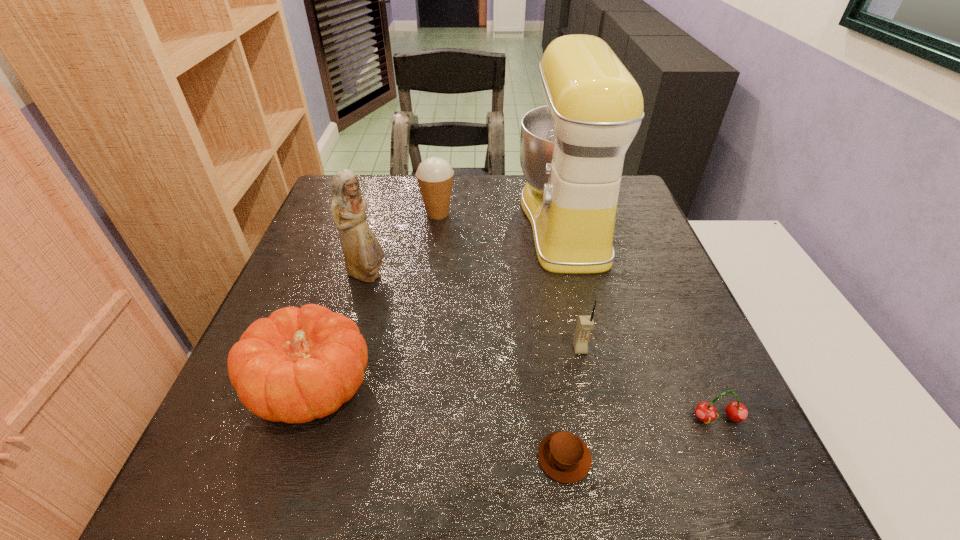
Identify the location of free space that is in between the tallest object and the muffin. (564, 340).

You are a GUI agent. You are given a task and a screenshot of the screen. Output one action in this format:
    pyautogui.click(x=<x>, y=<y>)
    Task: Click on the vacant space that is in between the pumpkin and the cellular telephone
    The width and height of the screenshot is (960, 540).
    Given the screenshot: What is the action you would take?
    pyautogui.click(x=446, y=368)

Locate an element on the screen. This screenshot has height=540, width=960. free space between the tallest object and the shortest object is located at coordinates (564, 340).

Image resolution: width=960 pixels, height=540 pixels. Find the location of `vacant point located between the mixer and the third object from left to right`. vacant point located between the mixer and the third object from left to right is located at coordinates (502, 218).

I want to click on vacant space that is in between the icecream and the figurine, so click(402, 245).

Locate an element on the screen. The image size is (960, 540). vacant area that lies between the fifth object from right to left and the cellular telephone is located at coordinates (509, 281).

I want to click on blank region between the muffin and the pumpkin, so click(439, 422).

I want to click on free spot between the fifth object from right to left and the pumpkin, so click(x=375, y=300).

Locate which object ranks fifth in proximity to the tallest object. Please provide its 2D coordinates. Your answer should be formatted as a tuple, i.e. [(x, y)], where the tuple contains the x and y coordinates of a point satisfying the conditions above.

[(297, 365)]

At what (x,y) coordinates should I click in order to perform the action: click on object that stands as the second closest to the cherry. Please return your answer as a coordinate pair (x, y). Looking at the image, I should click on (585, 324).